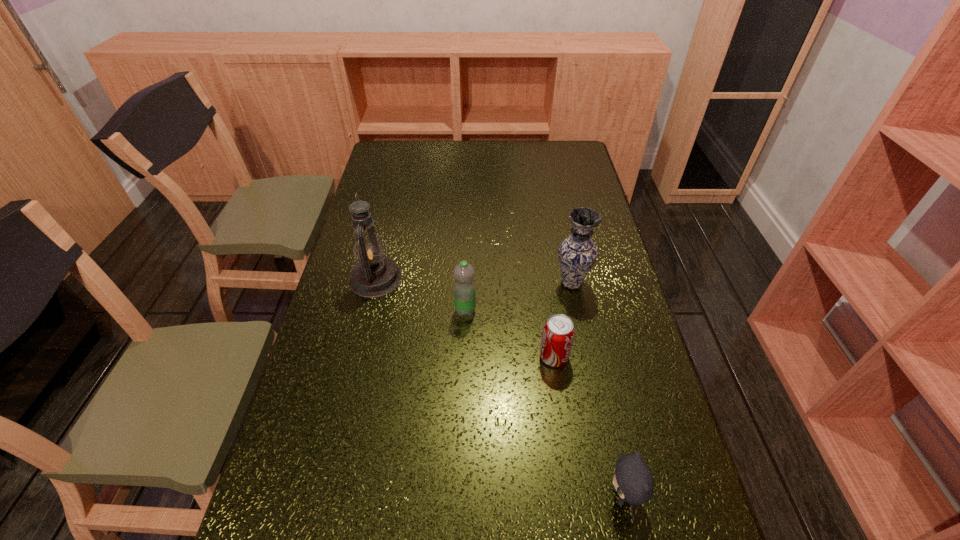
Where is `the tallest object`? Image resolution: width=960 pixels, height=540 pixels. the tallest object is located at coordinates (373, 275).

At what (x,y) coordinates should I click in order to perform the action: click on the leftmost object. Please return your answer as a coordinate pair (x, y). This screenshot has height=540, width=960. Looking at the image, I should click on (373, 275).

The image size is (960, 540). Find the location of `vase`. vase is located at coordinates (577, 254).

You are a GUI agent. You are given a task and a screenshot of the screen. Output one action in this format:
    pyautogui.click(x=<x>, y=<y>)
    Task: Click on the third tallest object
    This screenshot has width=960, height=540.
    Given the screenshot: What is the action you would take?
    pyautogui.click(x=464, y=288)

Locate an element on the screen. the fourth object from right to left is located at coordinates (464, 288).

The width and height of the screenshot is (960, 540). Identify the location of the fourth farthest object. (558, 333).

You are a GUI agent. You are given a task and a screenshot of the screen. Output one action in this format:
    pyautogui.click(x=<x>, y=<y>)
    Task: Click on the kitten
    Image resolution: width=960 pixels, height=540 pixels.
    Given the screenshot: What is the action you would take?
    coord(633,481)

Where is `free location located 0.180m on the front of the oil lamp`? This screenshot has height=540, width=960. free location located 0.180m on the front of the oil lamp is located at coordinates (359, 347).

This screenshot has width=960, height=540. I want to click on blank space located on the front of the vase, so click(x=583, y=337).

At what (x,y) coordinates should I click in order to perform the action: click on free space located on the back of the second object from left to right. Please return your answer as a coordinate pair (x, y). The width and height of the screenshot is (960, 540). Looking at the image, I should click on (468, 220).